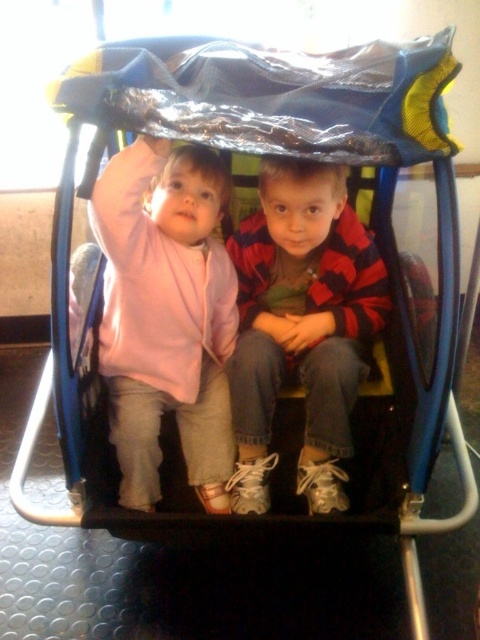
You are a photographer setting up for a family photo shoot inside the play structure. You need to ensure that the matte pink sweater at upper left and the red plaid shirt at center are both visible in the frame. Based on their positions, which item is closer to the camera?

The matte pink sweater at upper left is positioned over the red plaid shirt at center, meaning it is closer to the camera.

You are a robot navigating inside an indoor play area. You need to move from point A to point B. Point A is at coordinates point (219, 198) and point B is at coordinates point (245, 280). According to the image, which direction should you move to go from point A to point B?

To move from point A at coordinates point (219, 198) to point B at coordinates point (245, 280), you should move forward since point A is in front of point B.

You are a photographer setting up a shoot inside the play structure. You need to ensure that the matte pink sweater at upper left and the red plaid shirt at center are both visible in the frame. Which object should you adjust to avoid being blocked by the other?

The red plaid shirt at center is thicker than the matte pink sweater at upper left. To ensure both are visible, adjust the position of the red plaid shirt at center so it doesn not block the thinner matte pink sweater at upper left.